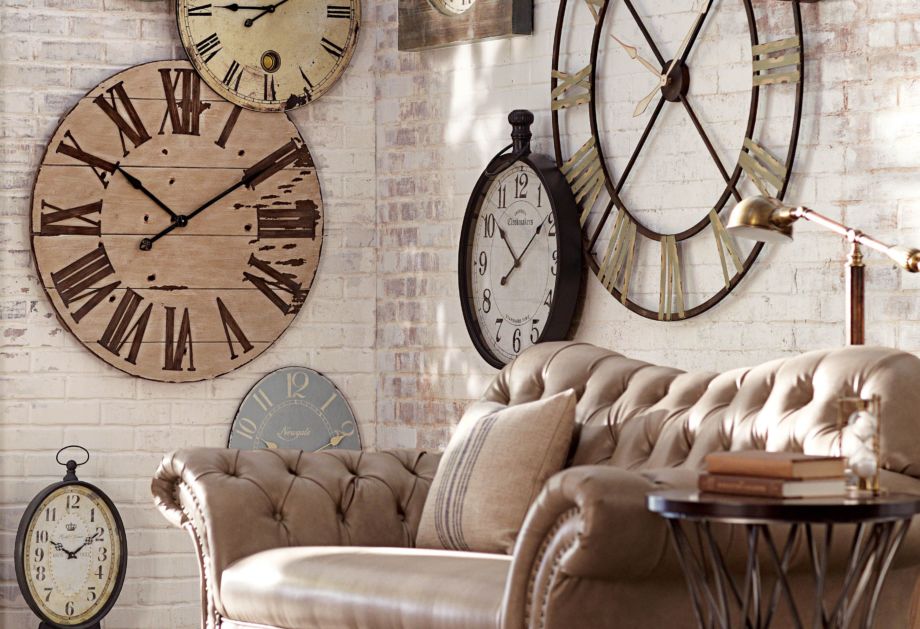
Where is `clocks`? The width and height of the screenshot is (920, 629). clocks is located at coordinates (269, 2), (169, 216), (539, 253), (659, 143), (95, 541), (280, 402).